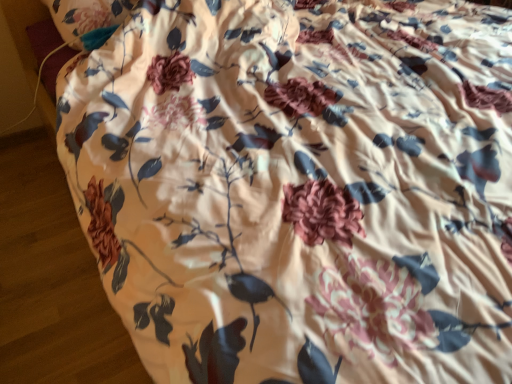
What do you see at coordinates (88, 16) in the screenshot? I see `teal fabric pillow at upper left` at bounding box center [88, 16].

You are a GUI agent. You are given a task and a screenshot of the screen. Output one action in this format:
    pyautogui.click(x=<x>, y=<y>)
    Task: Click on the teal fabric pillow at upper left
    
    Given the screenshot: What is the action you would take?
    click(x=88, y=16)

Where is `teal fabric pillow at upper left`? The image size is (512, 384). teal fabric pillow at upper left is located at coordinates (88, 16).